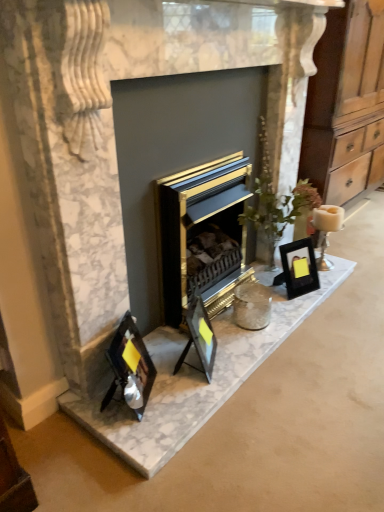
Question: Is matte black picture frame at center, placed as the second picture frame when sorted from front to back, wider or thinner than black glass photo frames at lower left?

Choices:
 (A) thin
 (B) wide

Answer: (B)

Question: Based on their positions, is matte black picture frame at center, the 2th picture frame from the right, located to the left or right of black glass photo frames at lower left?

Choices:
 (A) right
 (B) left

Answer: (A)

Question: Which object is positioned farthest from the matte black picture frame at center, the 2th picture frame from the left?

Choices:
 (A) black glass photo frames at lower left
 (B) gold metallic fireplace at center
 (C) white ceramic candle at right
 (D) wooden dresser at right
 (E) metallic silver photo frame at lower left, arranged as the first picture frame when viewed from the front

Answer: (D)

Question: Which object is positioned closest to the gold metallic fireplace at center?

Choices:
 (A) matte black picture frame at center, the 2th picture frame from the right
 (B) metallic silver photo frame at lower left, arranged as the first picture frame when viewed from the front
 (C) wooden dresser at right
 (D) white ceramic candle at right
 (E) black glass photo frames at lower left

Answer: (A)